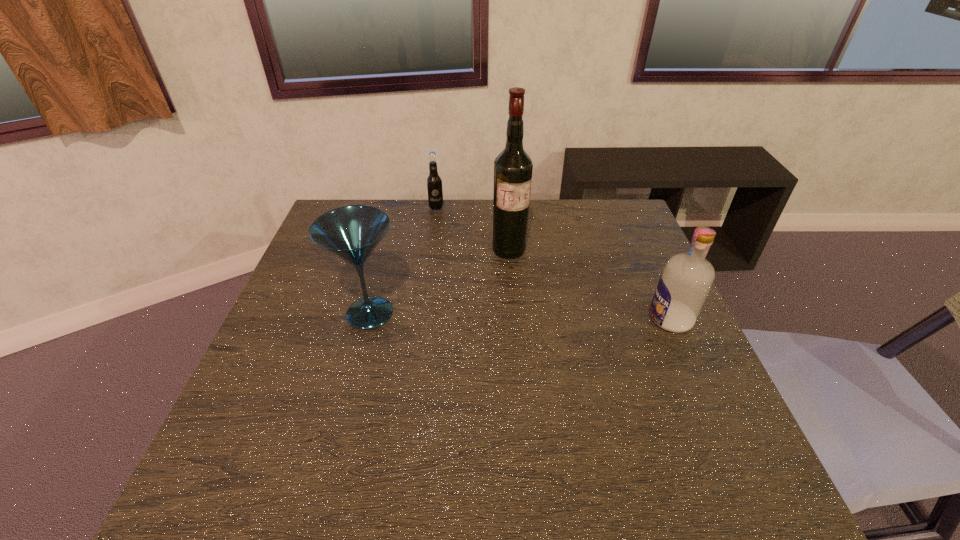
I want to click on blank region between the wine bottle and the leftmost object, so click(x=440, y=281).

This screenshot has height=540, width=960. I want to click on free space between the third nearest object and the leftmost object, so click(x=440, y=281).

What are the coordinates of `free point between the root beer and the second farthest object` in the screenshot? It's located at (472, 229).

Find the location of `vacant space that is in between the leftmost object and the vodka`. vacant space that is in between the leftmost object and the vodka is located at coordinates pyautogui.click(x=520, y=316).

At what (x,y) coordinates should I click in order to perform the action: click on unoccupied position between the vodka and the tallest object. Please return your answer as a coordinate pair (x, y). Looking at the image, I should click on pos(589,285).

Locate an element on the screen. The image size is (960, 540). unoccupied position between the rightmost object and the third nearest object is located at coordinates (589, 285).

Where is `free space between the third nearest object and the vodka`? This screenshot has width=960, height=540. free space between the third nearest object and the vodka is located at coordinates (589, 285).

At what (x,y) coordinates should I click in order to perform the action: click on free space between the martini and the rightmost object. Please return your answer as a coordinate pair (x, y). The image size is (960, 540). Looking at the image, I should click on (520, 316).

This screenshot has height=540, width=960. Identify the location of object that can be found as the second closest to the vodka. (351, 233).

Identify the location of object that is the second closest to the tallest object. This screenshot has height=540, width=960. (351, 233).